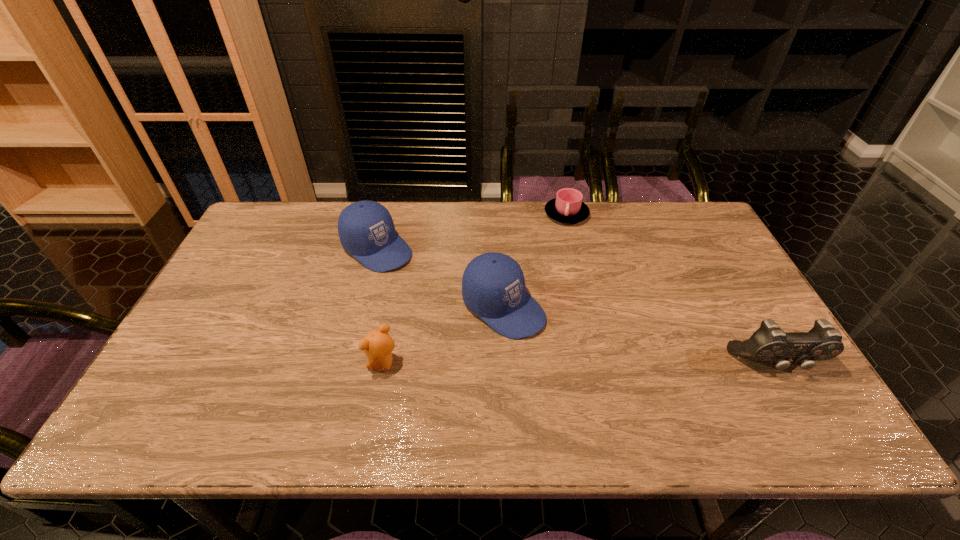
Where is `cap at the far edge`? The width and height of the screenshot is (960, 540). cap at the far edge is located at coordinates (366, 229).

Find the location of a particular element. The width and height of the screenshot is (960, 540). teddy bear at the near edge is located at coordinates (377, 344).

You are a GUI agent. You are given a task and a screenshot of the screen. Output one action in this format:
    pyautogui.click(x=<x>, y=<y>)
    Task: Click on the control present at the near edge
    The image size is (960, 540).
    Given the screenshot: What is the action you would take?
    [x=769, y=343]

This screenshot has width=960, height=540. In order to click on object that is positioned at the right edge in this screenshot , I will do `click(769, 343)`.

Where is `object that is positioned at the near right corner`? This screenshot has width=960, height=540. object that is positioned at the near right corner is located at coordinates click(x=769, y=343).

Find the location of a particular element. free region at the far edge is located at coordinates (622, 224).

In the image, there is a desktop. Where is `free region at the near edge`? Image resolution: width=960 pixels, height=540 pixels. free region at the near edge is located at coordinates (588, 387).

Identify the location of vacant space at the left edge of the desktop. (190, 360).

Find the location of a particular element. This screenshot has width=960, height=540. vacant space at the right edge is located at coordinates (706, 274).

Locate an element on the screen. free space at the near left corner of the desktop is located at coordinates (166, 379).